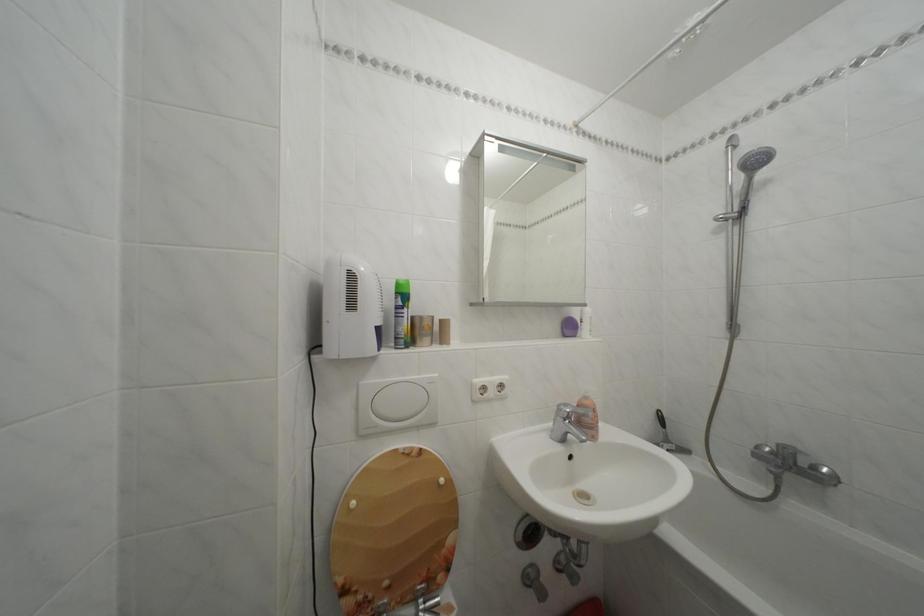
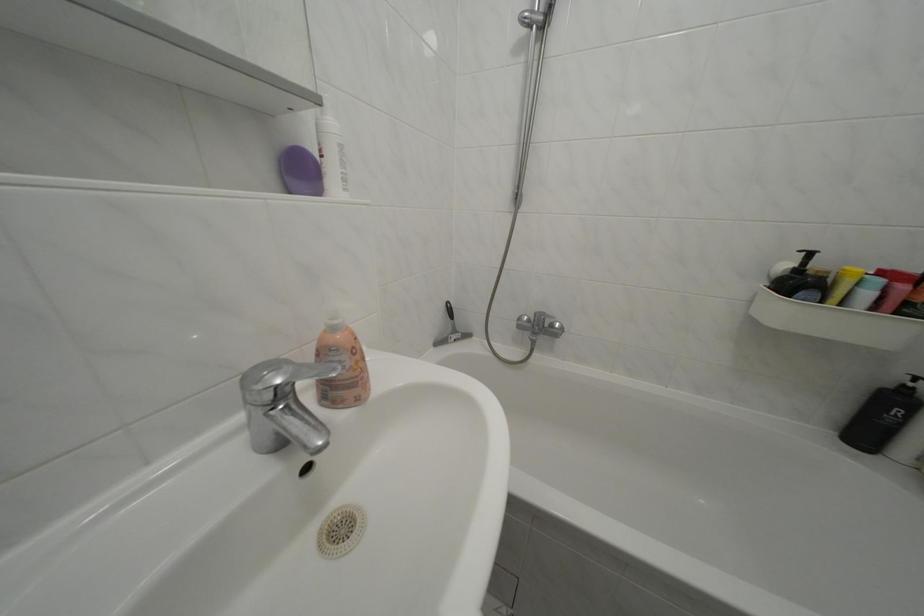
Where in the second image is the point corresponding to (567,411) from the first image?

(252, 384)